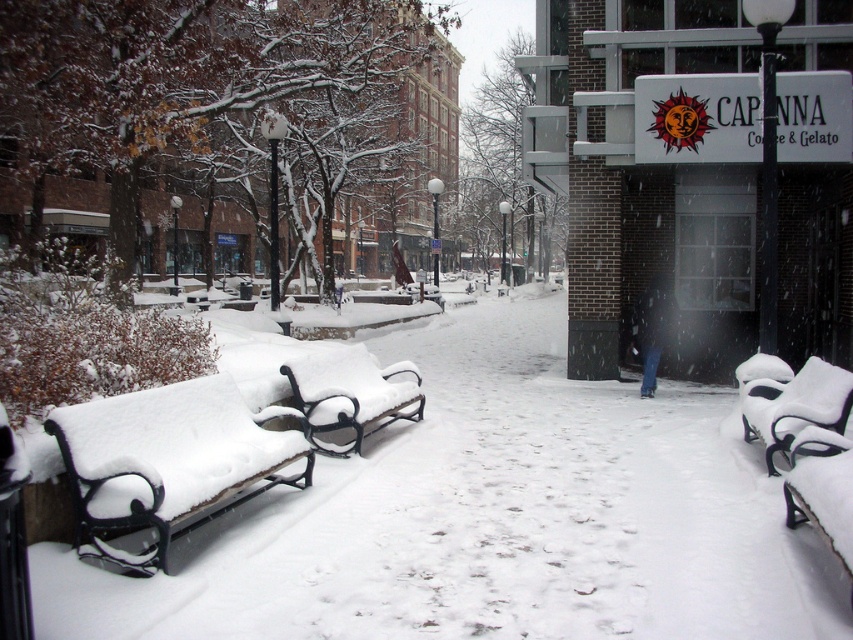
You are standing at the starting point of the pathway in the winter scene and want to reach the Capanna Coffee Gelato sign on the building. There are two points marked on your path. Which point should you walk towards first to get closer to your destination? The points are point (366, 433) and point (815, 368).

You should walk towards point (815, 368) first because it is further away from you than point (366, 433), which is closer. Since your destination is the Capanna Coffee Gelato sign, moving towards the point that is further away will help you progress along the pathway towards the building.